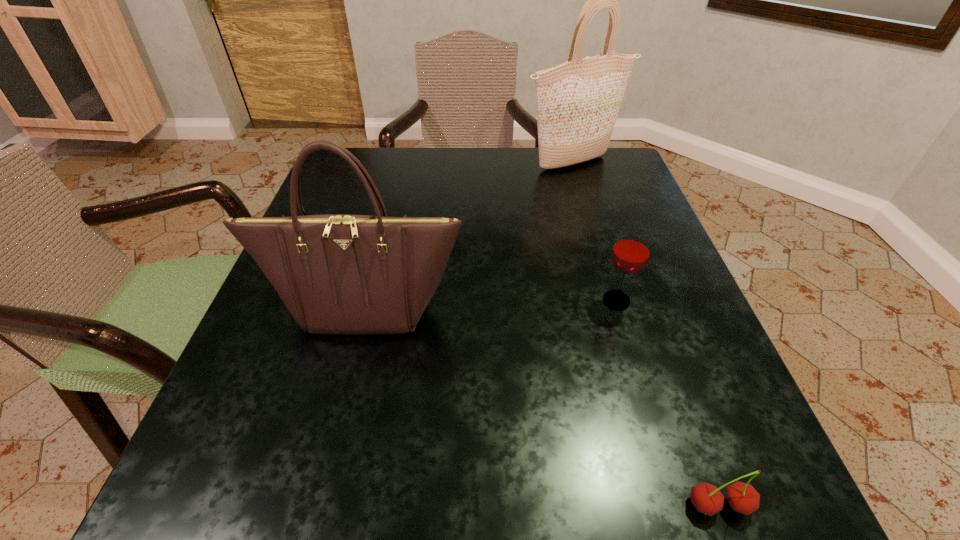
Locate an element on the screen. This screenshot has height=540, width=960. the farthest object is located at coordinates (578, 101).

The width and height of the screenshot is (960, 540). Identify the location of shopping bag. (578, 101).

In order to click on handbag in this screenshot , I will do `click(341, 274)`.

Image resolution: width=960 pixels, height=540 pixels. Identify the location of the leftmost object. (341, 274).

Where is `glass`? This screenshot has height=540, width=960. glass is located at coordinates (631, 251).

Where is `cherry`? This screenshot has width=960, height=540. cherry is located at coordinates (742, 497).

Locate an element on the screen. Image resolution: width=960 pixels, height=540 pixels. the nearest object is located at coordinates (742, 497).

Where is `free space located 0.250m on the front of the farthest object`? The image size is (960, 540). free space located 0.250m on the front of the farthest object is located at coordinates (596, 245).

Locate an element on the screen. The image size is (960, 540). vacant space located 0.160m on the front-facing side of the leftmost object is located at coordinates pyautogui.click(x=334, y=433).

Where is `free location located on the left of the glass`? free location located on the left of the glass is located at coordinates (501, 300).